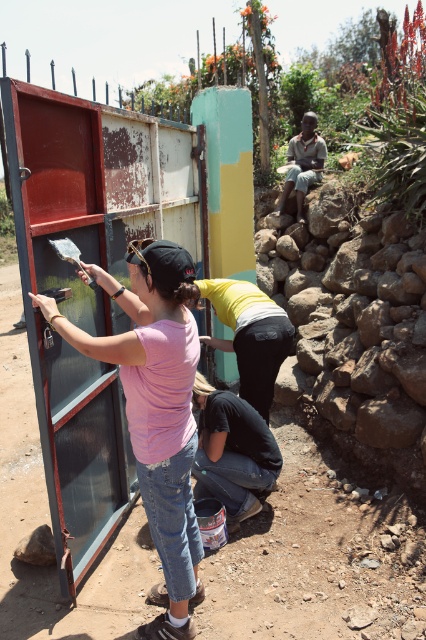
Question: Which point is closer to the camera taking this photo?

Choices:
 (A) (169, 579)
 (B) (273, 460)

Answer: (A)

Question: Is pink matte shirt at center closer to camera compared to denim jeans at lower center?

Choices:
 (A) yes
 (B) no

Answer: (A)

Question: Which of the following is the farthest from the observer?

Choices:
 (A) denim jeans at lower center
 (B) pink matte shirt at center
 (C) light brown wooden chair at upper center

Answer: (C)

Question: Can you confirm if denim jeans at lower center is positioned to the left of light brown wooden chair at upper center?

Choices:
 (A) yes
 (B) no

Answer: (A)

Question: Which object appears farthest from the camera in this image?

Choices:
 (A) pink matte shirt at center
 (B) light brown wooden chair at upper center
 (C) denim jeans at lower center

Answer: (B)

Question: Is denim jeans at lower center in front of light brown wooden chair at upper center?

Choices:
 (A) yes
 (B) no

Answer: (A)